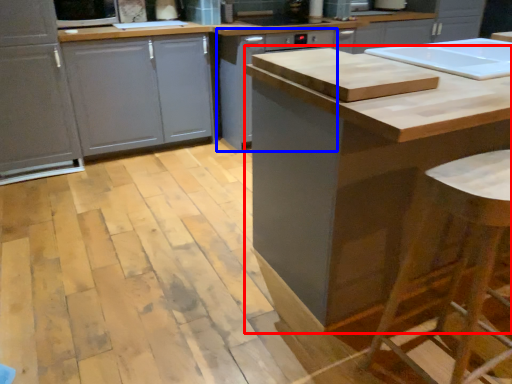
Question: Which object is closer to the camera taking this photo, cabinetry (highlighted by a red box) or cabinetry (highlighted by a blue box)?

Choices:
 (A) cabinetry
 (B) cabinetry

Answer: (A)